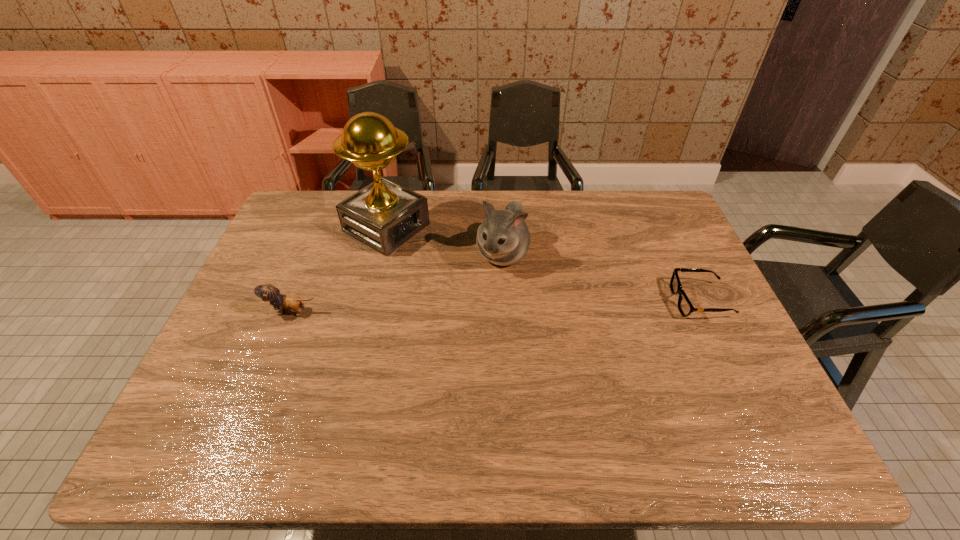
Locate an element on the screen. vacant space situated on the face of the second object from right to left is located at coordinates (465, 328).

Locate an element on the screen. This screenshot has height=540, width=960. blank area located 0.260m on the face of the second object from right to left is located at coordinates (457, 343).

The image size is (960, 540). Identify the location of vacant space located on the front-facing side of the tallest object. (433, 252).

Locate an element on the screen. This screenshot has width=960, height=540. blank space located 0.190m on the front-facing side of the tallest object is located at coordinates (466, 269).

Where is `free location located 0.090m on the front-facing side of the tallest object`? free location located 0.090m on the front-facing side of the tallest object is located at coordinates (440, 256).

Find the location of a particular element. This screenshot has width=960, height=540. hamster at the far edge is located at coordinates (503, 238).

Identify the location of award located in the far edge section of the desktop. (384, 215).

Where is `object present at the left edge`? The height and width of the screenshot is (540, 960). object present at the left edge is located at coordinates (268, 292).

At what (x,y) coordinates should I click in order to perform the action: click on object situated at the right edge. Please return your answer as a coordinate pair (x, y). Looking at the image, I should click on (685, 307).

Identify the location of free space at the far edge. The height and width of the screenshot is (540, 960). (467, 200).